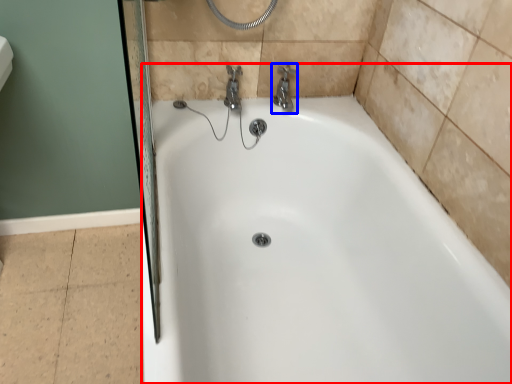
Question: Among these objects, which one is nearest to the camera, bathtub (highlighted by a red box) or tap (highlighted by a blue box)?

Choices:
 (A) bathtub
 (B) tap

Answer: (A)